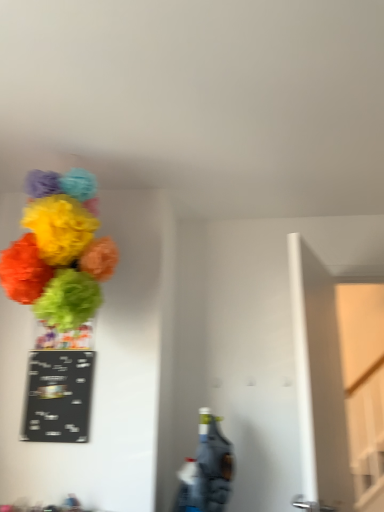
Question: From the image's perspective, is black chalkboard at left located beneath green matte vase at upper left?

Choices:
 (A) yes
 (B) no

Answer: (A)

Question: From a real-world perspective, is black chalkboard at left on green matte vase at upper left?

Choices:
 (A) no
 (B) yes

Answer: (A)

Question: Is black chalkboard at left outside green matte vase at upper left?

Choices:
 (A) yes
 (B) no

Answer: (A)

Question: Could you tell me if black chalkboard at left is facing green matte vase at upper left?

Choices:
 (A) yes
 (B) no

Answer: (B)

Question: Is the depth of black chalkboard at left greater than that of green matte vase at upper left?

Choices:
 (A) yes
 (B) no

Answer: (B)

Question: Is black chalkboard at left at the left side of green matte vase at upper left?

Choices:
 (A) no
 (B) yes

Answer: (A)

Question: Does green matte vase at upper left come behind bright paper pom-poms at upper left?

Choices:
 (A) yes
 (B) no

Answer: (A)

Question: From a real-world perspective, is green matte vase at upper left over bright paper pom-poms at upper left?

Choices:
 (A) no
 (B) yes

Answer: (A)

Question: Does green matte vase at upper left appear on the left side of bright paper pom-poms at upper left?

Choices:
 (A) yes
 (B) no

Answer: (A)

Question: Considering the relative positions of green matte vase at upper left and bright paper pom-poms at upper left in the image provided, is green matte vase at upper left to the right of bright paper pom-poms at upper left from the viewer's perspective?

Choices:
 (A) no
 (B) yes

Answer: (A)

Question: Is green matte vase at upper left positioned with its back to bright paper pom-poms at upper left?

Choices:
 (A) yes
 (B) no

Answer: (B)

Question: Would you say green matte vase at upper left is a long distance from bright paper pom-poms at upper left?

Choices:
 (A) yes
 (B) no

Answer: (B)

Question: From a real-world perspective, is black chalkboard at left beneath bright paper pom-poms at upper left?

Choices:
 (A) yes
 (B) no

Answer: (A)